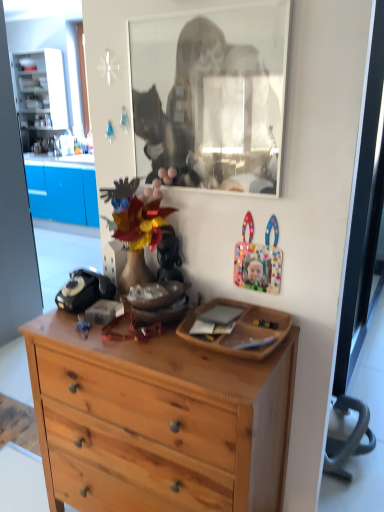
Locate an element on the screen. This screenshot has height=512, width=384. vacant point above natural wood dresser at center (from a real-world perspective) is located at coordinates (139, 329).